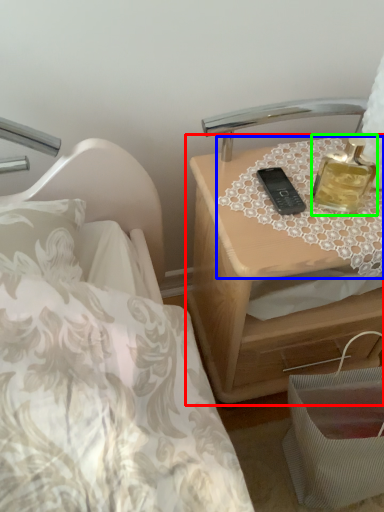
Question: Estimate the real-world distances between objects in this image. Which object is closer to nightstand (highlighted by a red box), tablecloth (highlighted by a blue box) or perfume (highlighted by a green box)?

Choices:
 (A) tablecloth
 (B) perfume

Answer: (A)